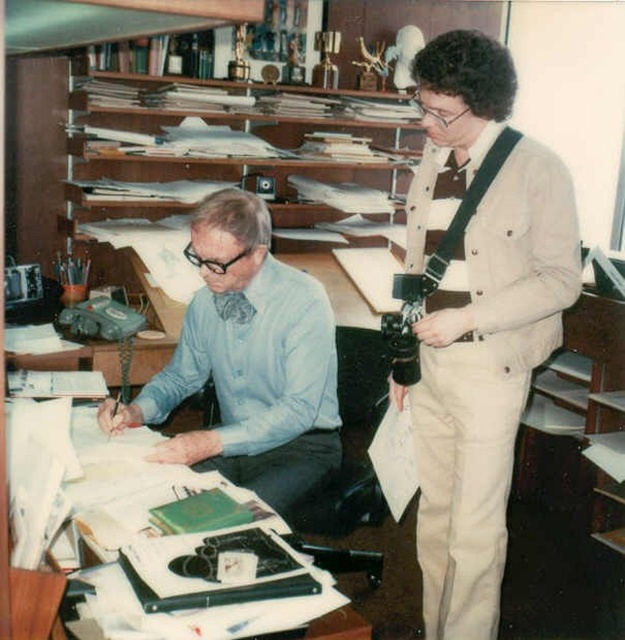
You are a visitor in this office and need to hand a document to the person at the desk. However, there is a beige cotton shirt at right in your way. Can you easily walk around the white paper at center to reach the desk?

The beige cotton shirt at right is much taller than the white paper at center, so you might have difficulty seeing or reaching the desk due to the height of the beige cotton shirt at right blocking your path.

You are organizing the office and need to place a new poster on the wall. The poster is larger than the white paper at center. Where should you place the poster so it doesn not overlap with the wooden shelves at upper center?

Since the white paper at center is behind the wooden shelves at upper center, placing the poster behind the wooden shelves at upper center would prevent overlap. However, if the poster is larger than the white paper at center, ensure it doesn not extend beyond the space occupied by the white paper at center to avoid covering the shelves.

You are organizing a clothing donation drive and need to categorize the beige cotton shirt at right and the blue shirt at center based on their sizes. Which shirt should be placed in the large size bin?

The beige cotton shirt at right should be placed in the large size bin because it has a larger size compared to the blue shirt at center.